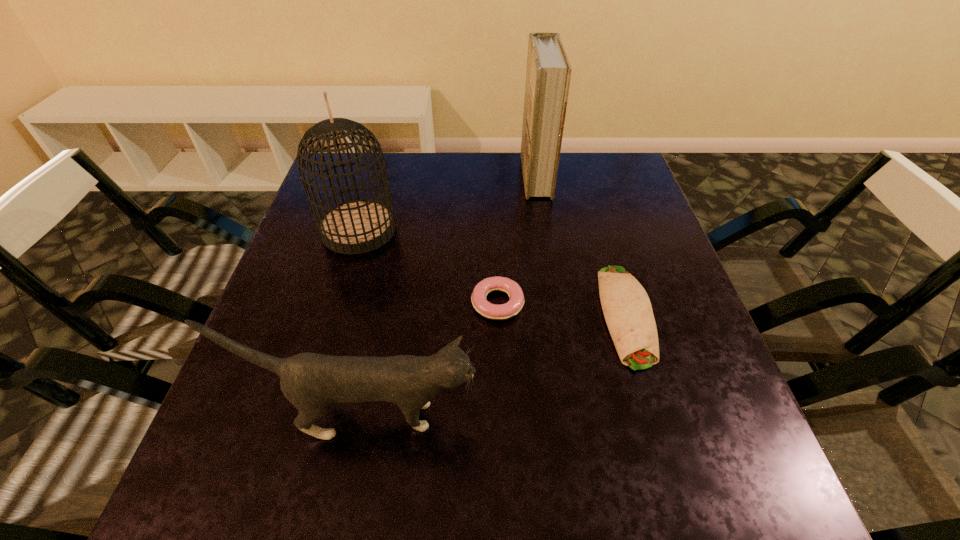
Identify the location of free space located 0.180m on the back of the birdcage. (376, 170).

Where is `vacant space located at the face of the cat`? vacant space located at the face of the cat is located at coordinates (644, 416).

Identify the location of free location located at the bitten end of the rightmost object. (679, 492).

At what (x,y) coordinates should I click in order to perform the action: click on vacant area located 0.230m on the back of the shortest object. Please return your answer as a coordinate pair (x, y). The image size is (960, 540). Looking at the image, I should click on (494, 219).

Locate an element on the screen. The height and width of the screenshot is (540, 960). object situated at the far edge is located at coordinates (548, 75).

In order to click on birdcage that is at the left edge in this screenshot , I will do `click(358, 226)`.

Where is `cat that is at the left edge`? This screenshot has width=960, height=540. cat that is at the left edge is located at coordinates (311, 382).

The image size is (960, 540). Find the location of `object present at the right edge`. object present at the right edge is located at coordinates (627, 309).

This screenshot has width=960, height=540. Find the location of `vacant position at the far edge of the desktop`. vacant position at the far edge of the desktop is located at coordinates (466, 158).

Where is `vacant space at the near edge of the desktop`? vacant space at the near edge of the desktop is located at coordinates pos(351,494).